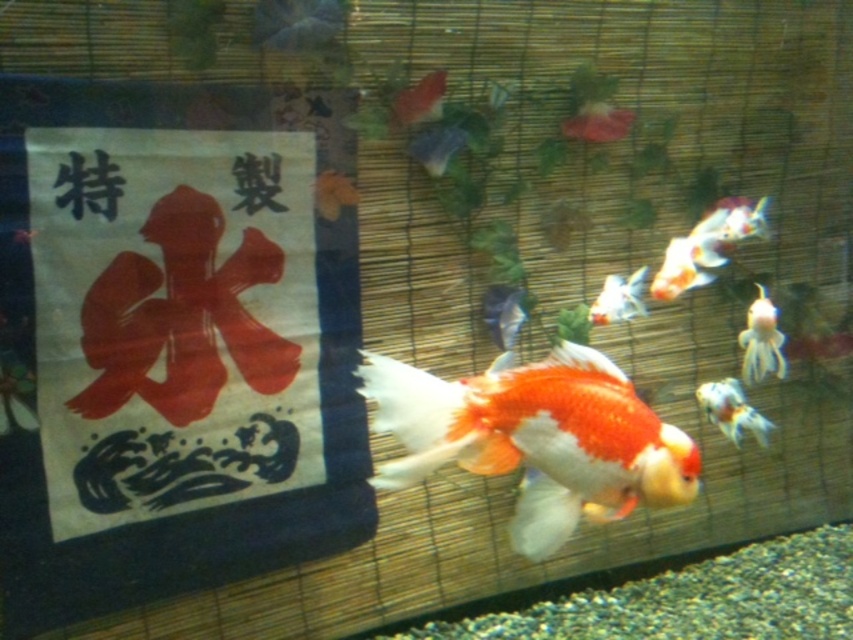
Between white glossy goldfish at right and translucent glass goldfish at upper right, which one is positioned higher?

translucent glass goldfish at upper right is higher up.

Identify the location of white glossy goldfish at right. (761, 340).

Can you confirm if shiny orange and white fish at center is shorter than white glossy goldfish at center?

Incorrect, shiny orange and white fish at center's height does not fall short of white glossy goldfish at center's.

Between shiny orange and white fish at center and white glossy goldfish at center, which one is positioned lower?

shiny orange and white fish at center

The image size is (853, 640). I want to click on shiny orange and white fish at center, so click(537, 438).

Between orange and white translucent goldfish at upper right and orange glossy goldfish at lower right, which one has more height?

orange and white translucent goldfish at upper right

Can you confirm if orange and white translucent goldfish at upper right is shorter than orange glossy goldfish at lower right?

In fact, orange and white translucent goldfish at upper right may be taller than orange glossy goldfish at lower right.

Which is in front, point (688, 285) or point (718, 413)?

Point (688, 285)

The width and height of the screenshot is (853, 640). In order to click on orange and white translucent goldfish at upper right in this screenshot , I will do `click(689, 259)`.